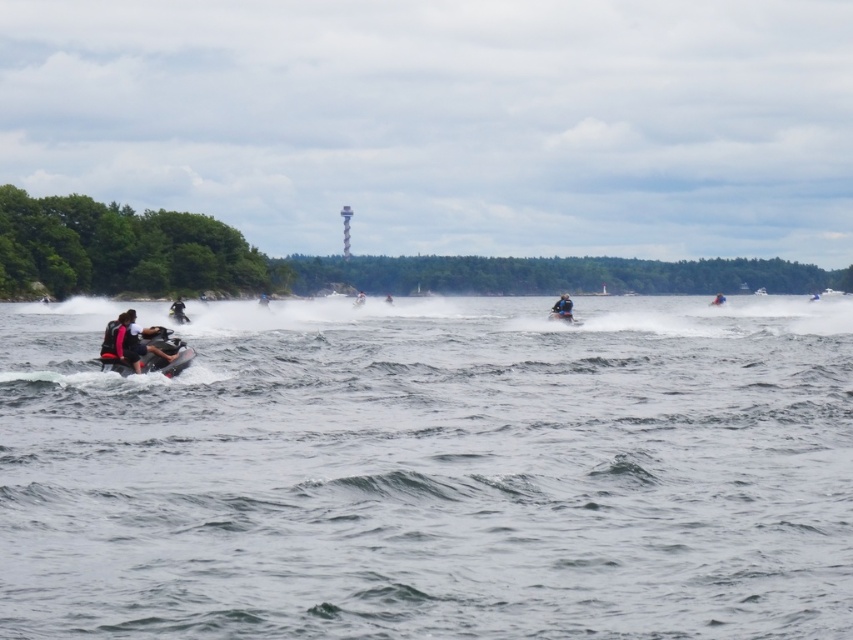
In the scene shown: You are a water safety officer and need to ensure that the blue rubber jet ski at center and the black rubber jet ski at left are maintaining a safe distance of at least 30 feet apart. Based on the scene, are they compliant with the safety regulations?

The blue rubber jet ski at center and the black rubber jet ski at left are 32.44 feet apart from each other, which exceeds the required 30 feet distance. Therefore, they are compliant with the safety regulations.

You are a drone operator trying to capture aerial footage of the blue rubber jet ski at center and the black rubber jet ski at left. Which jet ski would appear lower in the frame based on their positions?

The blue rubber jet ski at center appears lower in the frame because it is positioned below the black rubber jet ski at left.